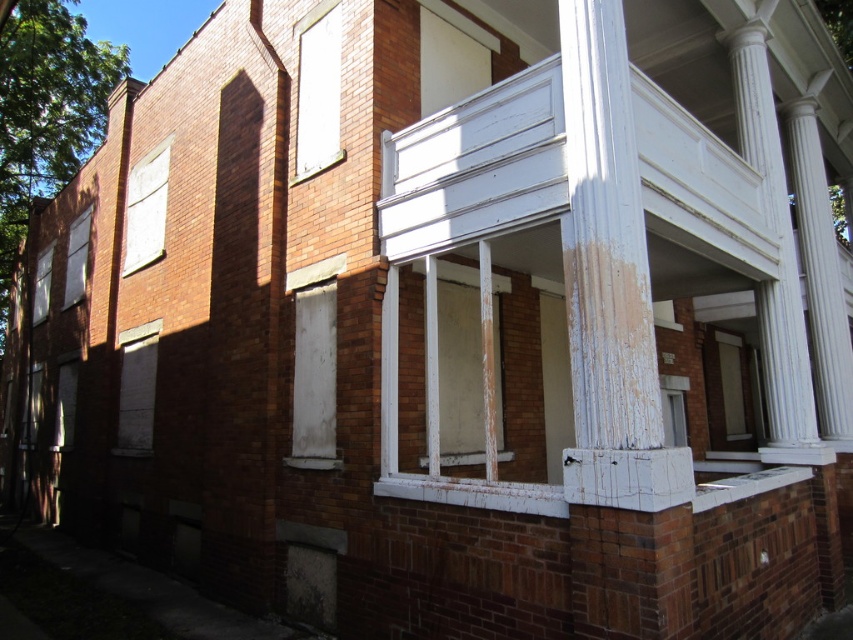
Question: Where is white painted wood window at center located in relation to matte white window at lower left in the image?

Choices:
 (A) below
 (B) above

Answer: (A)

Question: Does white weathered column at upper center appear under matte glass window at lower left?

Choices:
 (A) no
 (B) yes

Answer: (A)

Question: Which point is farther to the camera?

Choices:
 (A) (167, 140)
 (B) (56, 413)
 (C) (469, 371)

Answer: (B)

Question: Which point appears farthest from the camera in this image?

Choices:
 (A) (332, 428)
 (B) (479, 36)
 (C) (76, 378)

Answer: (C)

Question: Which object is farther from the camera taking this photo?

Choices:
 (A) white matte door at center
 (B) white matte window at upper center
 (C) matte glass window at lower left

Answer: (C)

Question: Can you confirm if white painted wood window at center is positioned above white matte window at lower left?

Choices:
 (A) no
 (B) yes

Answer: (B)